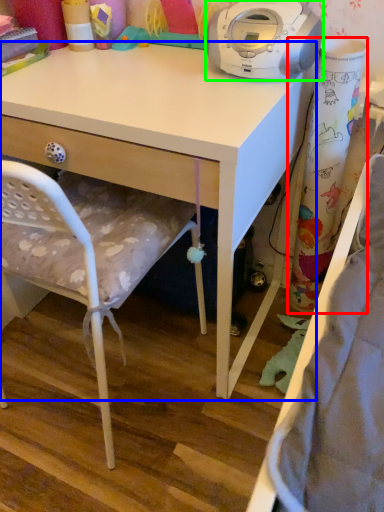
Question: Based on their relative distances, which object is farther from curtain (highlighted by a red box)? Choose from desk (highlighted by a blue box) and home appliance (highlighted by a green box).

Choices:
 (A) desk
 (B) home appliance

Answer: (A)